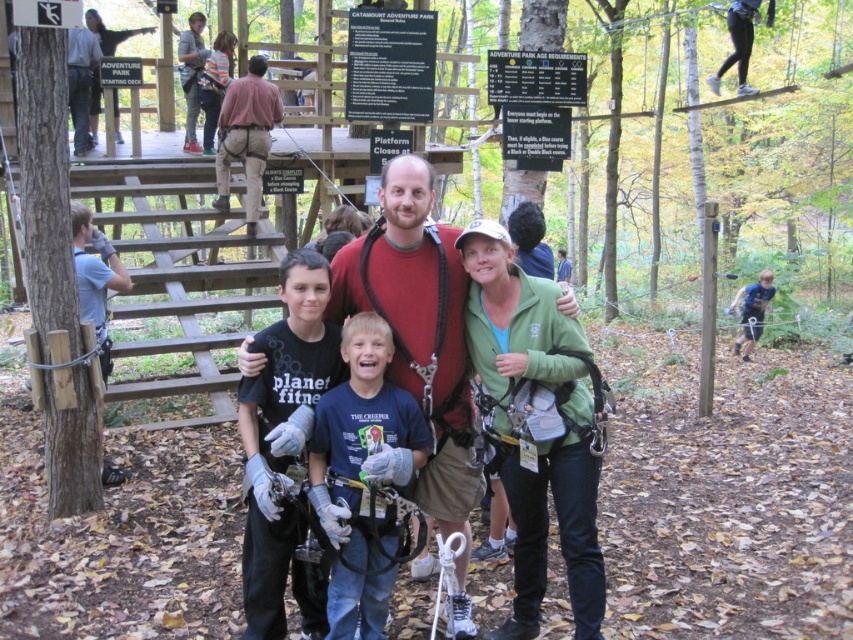
Question: Which object is the closest to the matte red shirt at center?

Choices:
 (A) blue cotton shirt at center
 (B) brown leather pants at upper center

Answer: (A)

Question: Is matte red shirt at center bigger than blue cotton shirt at center?

Choices:
 (A) yes
 (B) no

Answer: (A)

Question: Which point is closer to the camera?

Choices:
 (A) (276, 344)
 (B) (392, 192)
 (C) (225, 116)
 (D) (480, 284)

Answer: (B)

Question: Which point is farther from the camera taking this photo?

Choices:
 (A) (281, 109)
 (B) (370, 262)

Answer: (A)

Question: Is green softshell jacket at center positioned behind black cotton shirt at center?

Choices:
 (A) yes
 (B) no

Answer: (A)

Question: Is green softshell jacket at center to the left of black cotton shirt at center from the viewer's perspective?

Choices:
 (A) yes
 (B) no

Answer: (B)